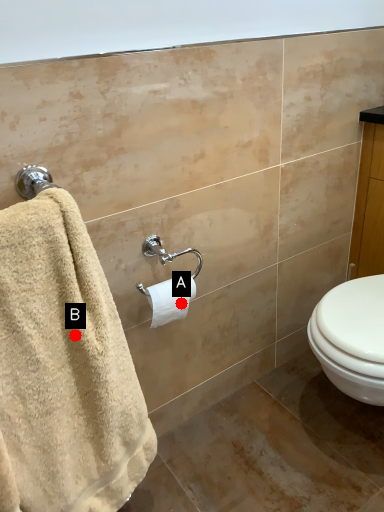
Question: Two points are circled on the image, labeled by A and B beside each circle. Which of the following is the closest to the observer?

Choices:
 (A) A is closer
 (B) B is closer

Answer: (B)